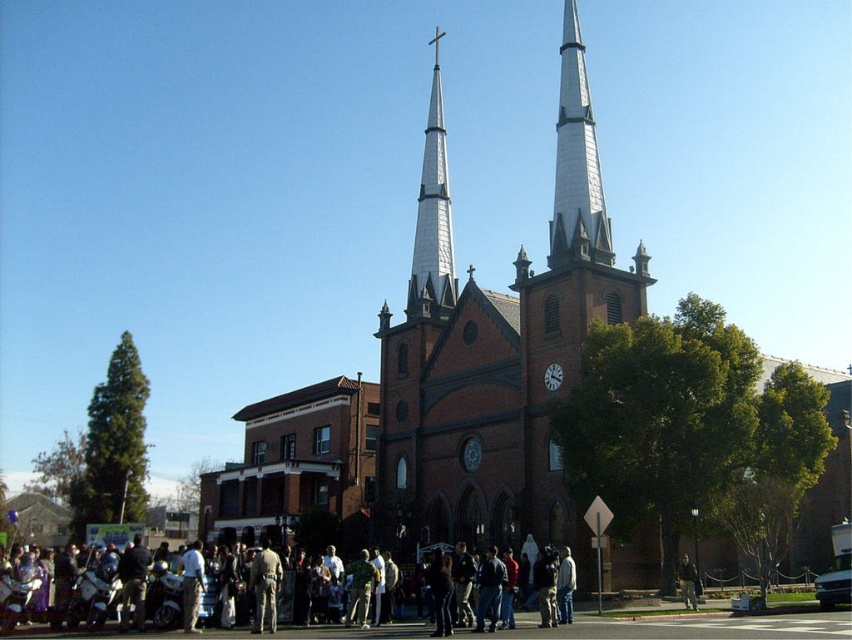
Does dark gray fabric jacket at center have a smaller size compared to white clock face at center?

Correct, dark gray fabric jacket at center occupies less space than white clock face at center.

From the picture: Does dark gray fabric jacket at center have a larger size compared to white clock face at center?

Actually, dark gray fabric jacket at center might be smaller than white clock face at center.

Is point (678, 582) farther from camera compared to point (551, 380)?

No, (678, 582) is closer to viewer.

I want to click on dark gray fabric jacket at center, so click(x=688, y=582).

Does camouflage pants at center have a smaller size compared to metallic clock face at center?

No, camouflage pants at center is not smaller than metallic clock face at center.

Between point (258, 612) and point (463, 445), which one is positioned in front?

Positioned in front is point (258, 612).

Identify the location of camouflage pants at center. (265, 586).

Image resolution: width=852 pixels, height=640 pixels. What do you see at coordinates (265, 586) in the screenshot?
I see `camouflage pants at center` at bounding box center [265, 586].

Between camouflage pants at center and white clock face at center, which one is positioned higher?

white clock face at center

What do you see at coordinates (265, 586) in the screenshot? I see `camouflage pants at center` at bounding box center [265, 586].

In order to click on camouflage pants at center in this screenshot , I will do `click(265, 586)`.